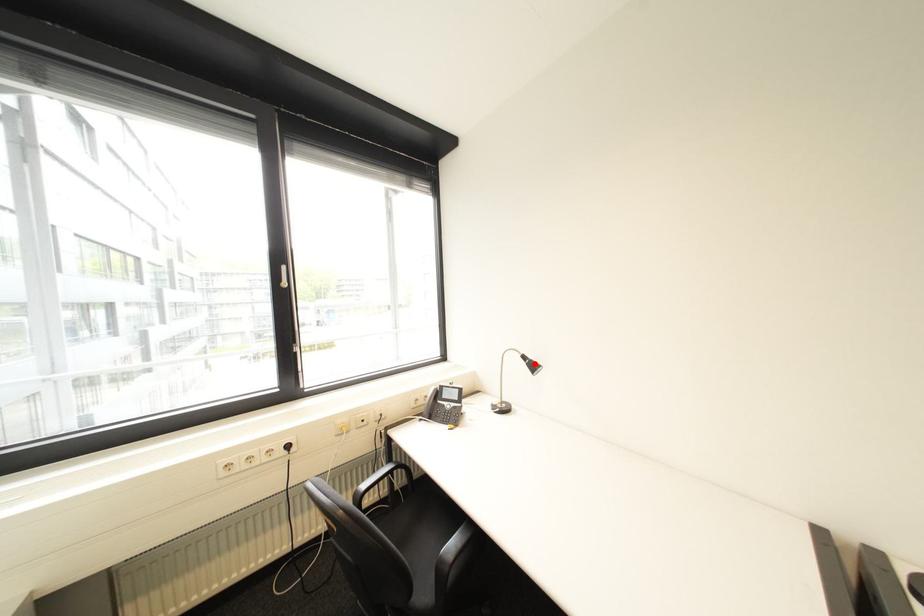
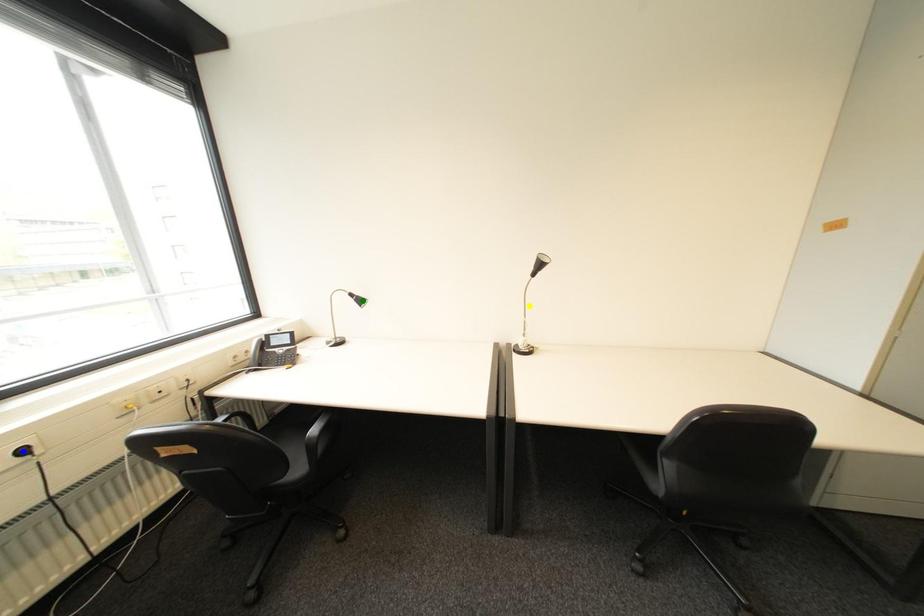
Question: I am providing you with two images of the same scene from different viewpoints. A red point is marked on the first image. You are given multiple points on the second image. Which mark in image 2 goes with the point in image 1?

Choices:
 (A) green point
 (B) yellow point
 (C) blue point

Answer: (A)